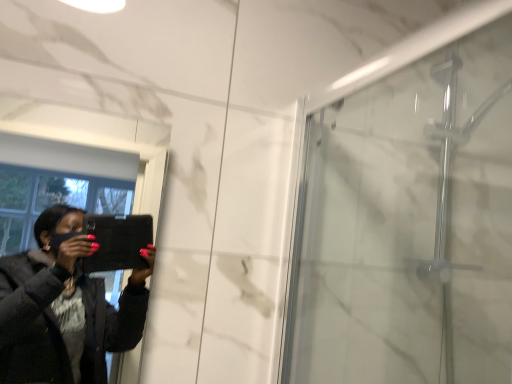
Question: Is matte black tablet at left inside the boundaries of transparent glass shower door at right, or outside?

Choices:
 (A) outside
 (B) inside

Answer: (A)

Question: From the image's perspective, relative to transparent glass shower door at right, is matte black tablet at left above or below?

Choices:
 (A) below
 (B) above

Answer: (A)

Question: From a real-world perspective, is matte black tablet at left above or below transparent glass shower door at right?

Choices:
 (A) above
 (B) below

Answer: (B)

Question: In the image, is transparent glass shower door at right positioned in front of or behind matte black tablet at left?

Choices:
 (A) front
 (B) behind

Answer: (B)

Question: In the image, is transparent glass shower door at right on the left side or the right side of matte black tablet at left?

Choices:
 (A) left
 (B) right

Answer: (B)

Question: In terms of width, does transparent glass shower door at right look wider or thinner when compared to matte black tablet at left?

Choices:
 (A) wide
 (B) thin

Answer: (A)

Question: In terms of size, does transparent glass shower door at right appear bigger or smaller than matte black tablet at left?

Choices:
 (A) small
 (B) big

Answer: (B)